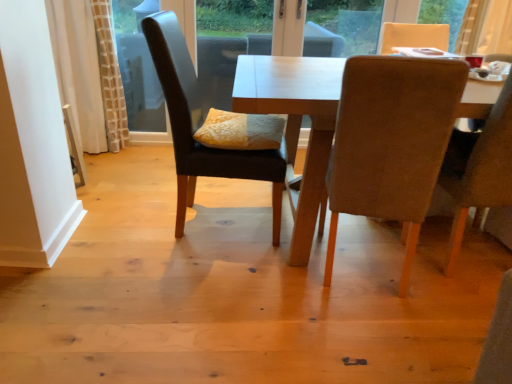
Question: From their relative heights in the image, would you say transparent glass window screen at upper left is taller or shorter than yellow textured pillow at center?

Choices:
 (A) short
 (B) tall

Answer: (B)

Question: Is transparent glass window screen at upper left wider or thinner than yellow textured pillow at center?

Choices:
 (A) thin
 (B) wide

Answer: (A)

Question: Which of these objects is positioned closest to the dark brown leather chair at center, which appears as the 3th chair when viewed from the right?

Choices:
 (A) light brown wooden table at center
 (B) yellow textured pillow at center
 (C) transparent glass window screen at upper left
 (D) beige fabric chair at right, placed as the 1th chair when sorted from right to left
 (E) velvet beige chair at right, the 2th chair when ordered from left to right

Answer: (B)

Question: Estimate the real-world distances between objects in this image. Which object is farther from the light brown wooden table at center?

Choices:
 (A) yellow textured pillow at center
 (B) transparent glass window screen at upper left
 (C) velvet beige chair at right, which is the 2th chair in right-to-left order
 (D) beige fabric chair at right, positioned as the third chair in left-to-right order
 (E) dark brown leather chair at center, which is counted as the 1th chair, starting from the left

Answer: (B)